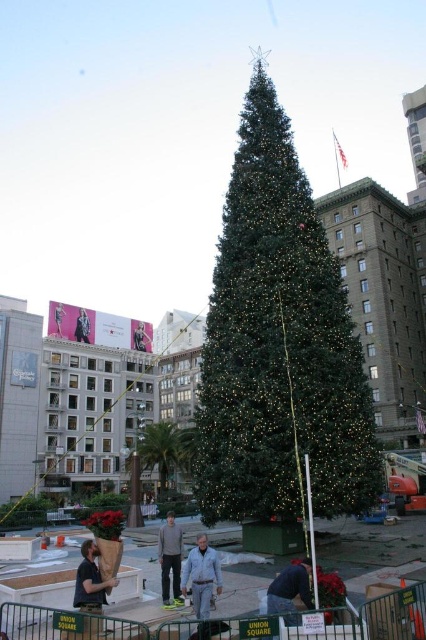
Question: Which point appears closest to the camera in this image?

Choices:
 (A) (58, 328)
 (B) (163, 534)

Answer: (B)

Question: Is dark blue jeans at lower center to the left of metallic silver jacket at center from the viewer's perspective?

Choices:
 (A) yes
 (B) no

Answer: (B)

Question: Is light blue denim jeans at center above metallic silver jacket at center?

Choices:
 (A) yes
 (B) no

Answer: (B)

Question: Which object is positioned closest to the black leather jacket at upper left?

Choices:
 (A) dark gray pants at center
 (B) dark blue jeans at lower center

Answer: (A)

Question: Which object is closer to the camera taking this photo?

Choices:
 (A) dark gray pants at center
 (B) black leather jacket at upper left
 (C) light blue denim jeans at center

Answer: (C)

Question: Can you confirm if light blue denim jeans at center is bigger than matte black jacket at upper left?

Choices:
 (A) yes
 (B) no

Answer: (A)